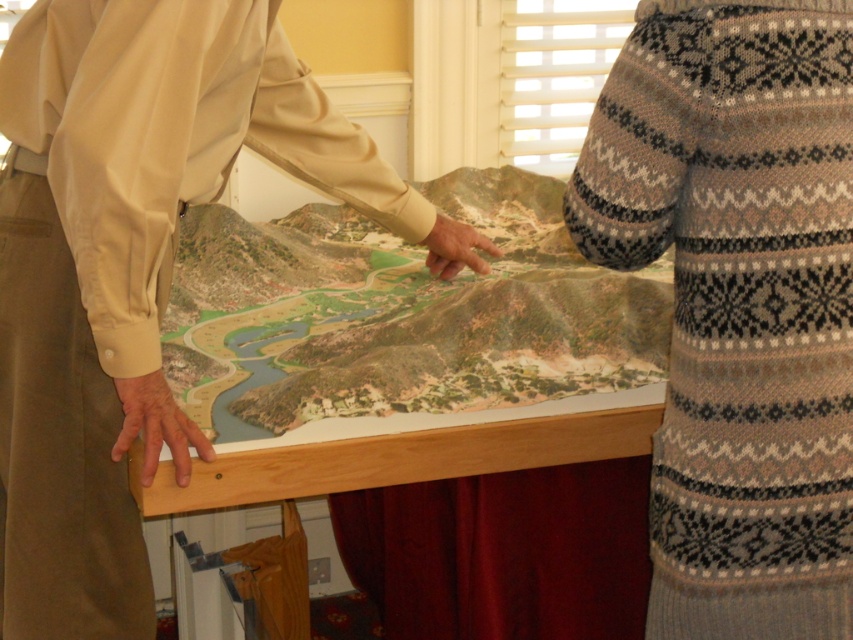
Image resolution: width=853 pixels, height=640 pixels. Describe the element at coordinates (738, 301) in the screenshot. I see `knitted sweater at upper right` at that location.

Is knitted sweater at upper right above beige fabric shirt at upper left?

Incorrect, knitted sweater at upper right is not positioned above beige fabric shirt at upper left.

You are a GUI agent. You are given a task and a screenshot of the screen. Output one action in this format:
    pyautogui.click(x=<x>, y=<y>)
    Task: Click on the knitted sweater at upper right
    The width and height of the screenshot is (853, 640).
    Given the screenshot: What is the action you would take?
    pyautogui.click(x=738, y=301)

In order to click on knitted sweater at upper right in this screenshot , I will do `click(738, 301)`.